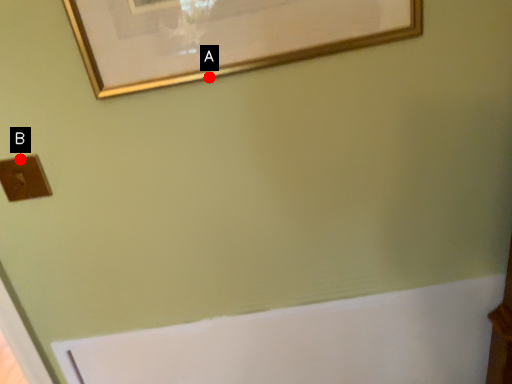
Question: Two points are circled on the image, labeled by A and B beside each circle. Which of the following is the closest to the observer?

Choices:
 (A) A is closer
 (B) B is closer

Answer: (A)